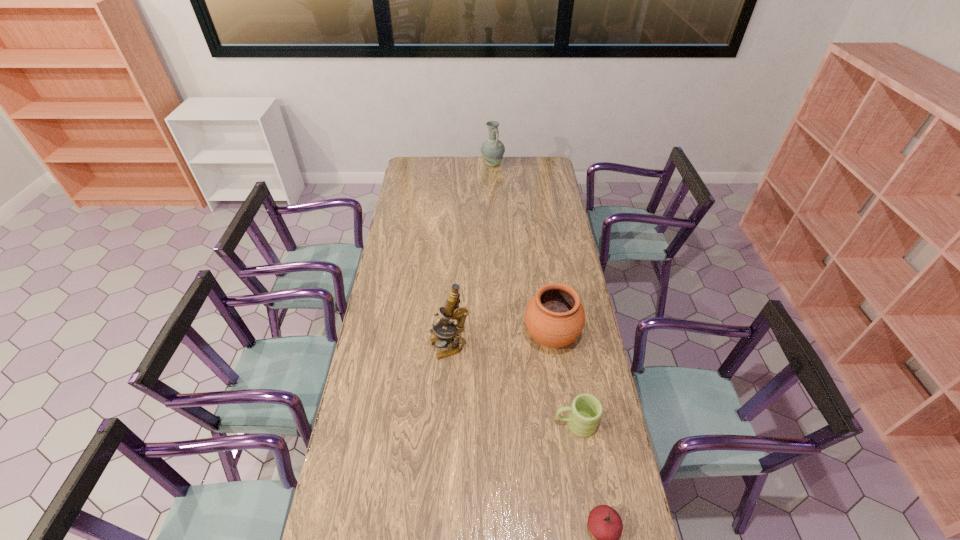
This screenshot has height=540, width=960. I want to click on free space located on the side of the fourth tallest object with the handle, so click(x=525, y=424).

This screenshot has width=960, height=540. Identify the location of blank space located 0.060m on the side of the fourth tallest object with the handle. (537, 424).

Where is `vacant region located on the side of the fourth tallest object with the handle`? The width and height of the screenshot is (960, 540). vacant region located on the side of the fourth tallest object with the handle is located at coordinates (534, 424).

Identify the location of object positioned at the far edge. (492, 150).

Image resolution: width=960 pixels, height=540 pixels. In order to click on pottery positioned at the right edge in this screenshot , I will do `click(554, 317)`.

The height and width of the screenshot is (540, 960). What are the coordinates of `mug positioned at the right edge` in the screenshot? It's located at (x=586, y=410).

This screenshot has width=960, height=540. In the image, there is a desktop. Identify the location of vacant space at the far edge. (512, 160).

You are a GUI agent. You are given a task and a screenshot of the screen. Output one action in this format:
    pyautogui.click(x=<x>, y=<y>)
    Task: Click on the free space at the left edge of the desktop
    The height and width of the screenshot is (540, 960).
    Given the screenshot: What is the action you would take?
    pyautogui.click(x=396, y=366)

You are a GUI agent. You are given a task and a screenshot of the screen. Output one action in this format:
    pyautogui.click(x=<x>, y=<y>)
    Task: Click on the vacant area at the right edge of the desktop
    
    Given the screenshot: What is the action you would take?
    pyautogui.click(x=561, y=199)

This screenshot has width=960, height=540. What are the coordinates of `free area in between the second object from left to right and the pottery` in the screenshot? It's located at (522, 251).